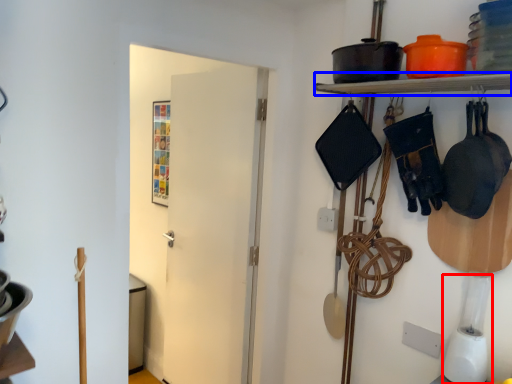
Question: Which of the following is the farthest to the observer, appliance (highlighted by a red box) or shelf (highlighted by a blue box)?

Choices:
 (A) appliance
 (B) shelf

Answer: (A)